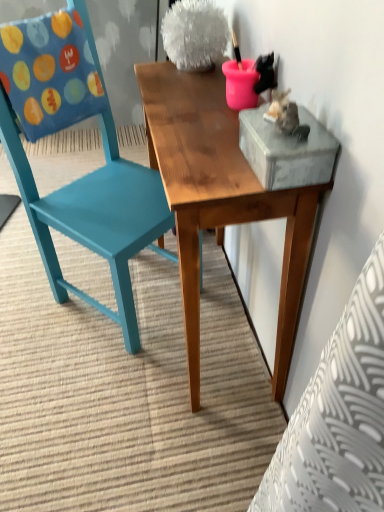
Question: Considering the relative sizes of teal painted wood chair at left and wooden table at center in the image provided, is teal painted wood chair at left taller than wooden table at center?

Choices:
 (A) no
 (B) yes

Answer: (B)

Question: Is teal painted wood chair at left facing towards wooden table at center?

Choices:
 (A) yes
 (B) no

Answer: (A)

Question: Considering the relative sizes of teal painted wood chair at left and wooden table at center in the image provided, is teal painted wood chair at left smaller than wooden table at center?

Choices:
 (A) no
 (B) yes

Answer: (A)

Question: Does teal painted wood chair at left have a lesser width compared to wooden table at center?

Choices:
 (A) no
 (B) yes

Answer: (A)

Question: Considering the relative sizes of teal painted wood chair at left and wooden table at center in the image provided, is teal painted wood chair at left shorter than wooden table at center?

Choices:
 (A) yes
 (B) no

Answer: (B)

Question: Does teal painted wood chair at left appear on the left side of wooden table at center?

Choices:
 (A) no
 (B) yes

Answer: (B)

Question: Is wooden table at center in contact with teal painted wood chair at left?

Choices:
 (A) yes
 (B) no

Answer: (B)

Question: From the image's perspective, does wooden table at center appear higher than teal painted wood chair at left?

Choices:
 (A) yes
 (B) no

Answer: (B)

Question: Does wooden table at center appear on the right side of teal painted wood chair at left?

Choices:
 (A) yes
 (B) no

Answer: (A)

Question: From a real-world perspective, is wooden table at center physically below teal painted wood chair at left?

Choices:
 (A) yes
 (B) no

Answer: (A)

Question: Is wooden table at center to the left of teal painted wood chair at left from the viewer's perspective?

Choices:
 (A) yes
 (B) no

Answer: (B)

Question: Does wooden table at center come behind teal painted wood chair at left?

Choices:
 (A) no
 (B) yes

Answer: (A)

Question: Relative to teal painted wood chair at left, is wooden table at center in front or behind?

Choices:
 (A) front
 (B) behind

Answer: (A)